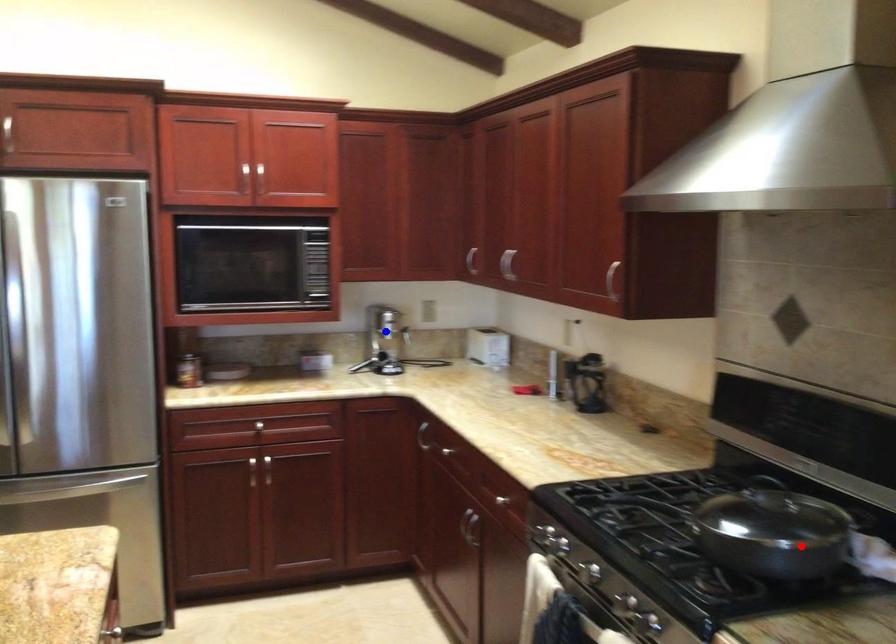
Question: Two points are marked on the image. Which point is closer to the camera?

Choices:
 (A) Blue point is closer.
 (B) Red point is closer.

Answer: (B)